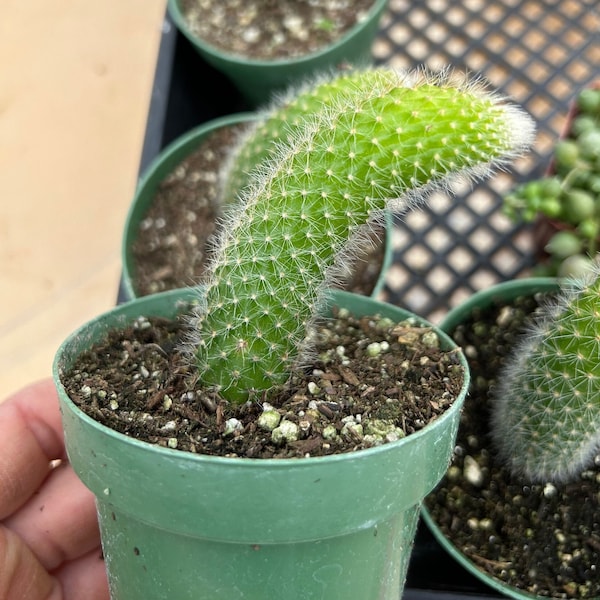
Where is `pot`? pot is located at coordinates (248, 583).